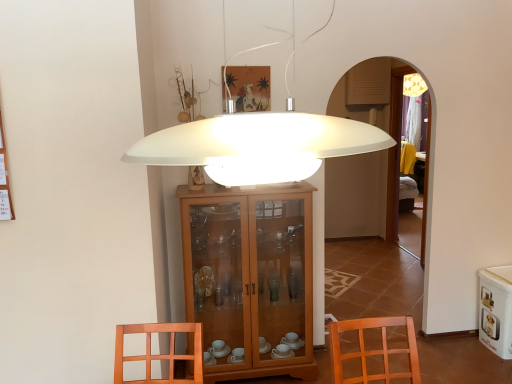
Question: From the image's perspective, is wooden cabinet at center above white glossy pet food container at lower right?

Choices:
 (A) no
 (B) yes

Answer: (B)

Question: Is wooden cabinet at center positioned behind white glossy pet food container at lower right?

Choices:
 (A) yes
 (B) no

Answer: (B)

Question: Considering the relative sizes of wooden cabinet at center and white glossy pet food container at lower right in the image provided, is wooden cabinet at center bigger than white glossy pet food container at lower right?

Choices:
 (A) no
 (B) yes

Answer: (B)

Question: From the image's perspective, is wooden cabinet at center below white glossy pet food container at lower right?

Choices:
 (A) no
 (B) yes

Answer: (A)

Question: Is wooden cabinet at center in front of white glossy pet food container at lower right?

Choices:
 (A) no
 (B) yes

Answer: (B)

Question: Looking at their shapes, would you say white glossy pet food container at lower right is wider or thinner than white matte lampshade at center?

Choices:
 (A) wide
 (B) thin

Answer: (A)

Question: Relative to white matte lampshade at center, is white glossy pet food container at lower right in front or behind?

Choices:
 (A) front
 (B) behind

Answer: (B)

Question: From their relative heights in the image, would you say white glossy pet food container at lower right is taller or shorter than white matte lampshade at center?

Choices:
 (A) short
 (B) tall

Answer: (B)

Question: Based on their sizes in the image, would you say white glossy pet food container at lower right is bigger or smaller than white matte lampshade at center?

Choices:
 (A) small
 (B) big

Answer: (A)

Question: Considering the relative positions of white glossy pet food container at lower right and wooden cabinet at center in the image provided, is white glossy pet food container at lower right to the left or to the right of wooden cabinet at center?

Choices:
 (A) left
 (B) right

Answer: (B)

Question: Is white glossy pet food container at lower right situated inside wooden cabinet at center or outside?

Choices:
 (A) outside
 (B) inside

Answer: (A)

Question: In terms of width, does white glossy pet food container at lower right look wider or thinner when compared to wooden cabinet at center?

Choices:
 (A) wide
 (B) thin

Answer: (A)

Question: Considering the positions of point (509, 311) and point (223, 195), is point (509, 311) closer or farther from the camera than point (223, 195)?

Choices:
 (A) farther
 (B) closer

Answer: (A)

Question: From the image's perspective, is white glossy pet food container at lower right above or below matte wooden picture frame at upper center?

Choices:
 (A) above
 (B) below

Answer: (B)

Question: Considering the positions of white glossy pet food container at lower right and matte wooden picture frame at upper center in the image, is white glossy pet food container at lower right bigger or smaller than matte wooden picture frame at upper center?

Choices:
 (A) small
 (B) big

Answer: (B)